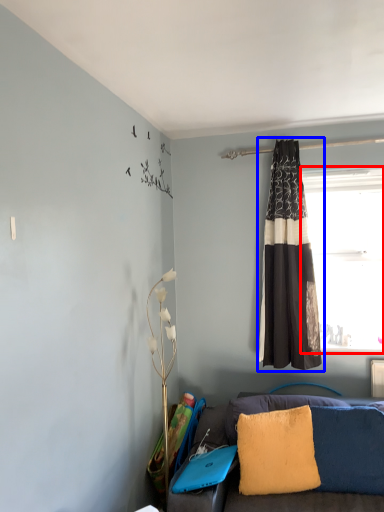
Question: Which object is closer to the camera taking this photo, window (highlighted by a red box) or curtain (highlighted by a blue box)?

Choices:
 (A) window
 (B) curtain

Answer: (B)